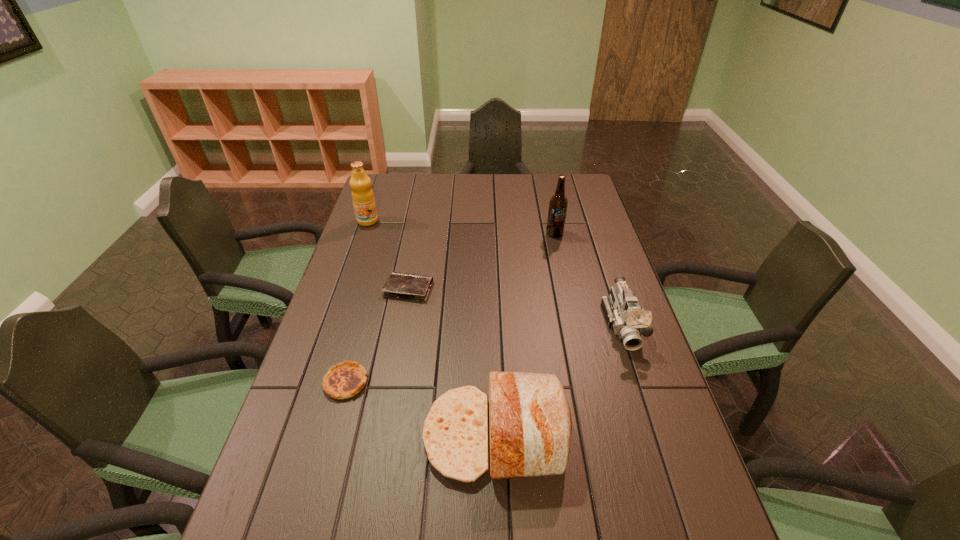
Find the location of a particular element. This screenshot has height=540, width=960. free location located at the sliced end of the fourth object from left to right is located at coordinates pos(345,435).

Find the location of a particular element. blank area located 0.310m at the sliced end of the fourth object from left to right is located at coordinates (288, 435).

Locate an element on the screen. The height and width of the screenshot is (540, 960). vacant region located on the front-facing side of the camcorder is located at coordinates (639, 376).

At what (x,y) coordinates should I click in order to perform the action: click on vacant space situated 0.100m on the left of the diary. Please return your answer as a coordinate pair (x, y). This screenshot has height=540, width=960. Looking at the image, I should click on (352, 289).

This screenshot has height=540, width=960. Find the location of `free space located 0.180m on the back of the quiche`. free space located 0.180m on the back of the quiche is located at coordinates 364,315.

Identify the location of fruit juice at the left edge. The image size is (960, 540). (363, 198).

Image resolution: width=960 pixels, height=540 pixels. What are the coordinates of `diary at the left edge` in the screenshot? It's located at (413, 287).

Where is `quiche present at the left edge`? Image resolution: width=960 pixels, height=540 pixels. quiche present at the left edge is located at coordinates (344, 380).

Locate an element on the screen. This screenshot has width=960, height=540. beer bottle that is at the right edge is located at coordinates (558, 203).

This screenshot has height=540, width=960. What are the coordinates of `camcorder that is at the right edge` in the screenshot? It's located at (622, 310).